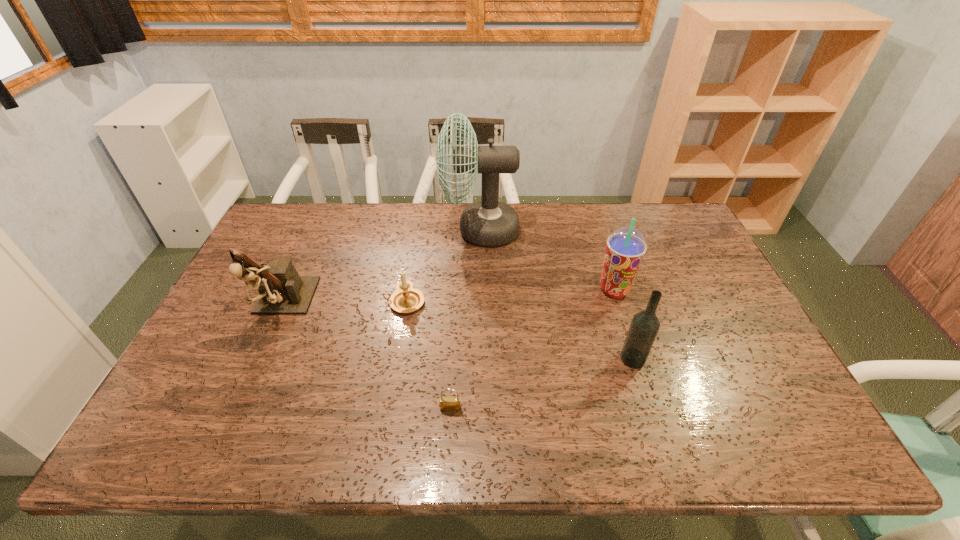
At what (x,y) coordinates should I click in order to perform the action: click on fan. Please return your answer as a coordinate pair (x, y). Looking at the image, I should click on (489, 222).

This screenshot has height=540, width=960. I want to click on the tallest object, so click(489, 222).

Find the location of `the leftmost object`. the leftmost object is located at coordinates (281, 290).

Identify the location of smoothie. This screenshot has width=960, height=540. (625, 248).

In order to click on the second nearest object in this screenshot , I will do `click(645, 325)`.

In order to click on the fifth object from right to left in this screenshot , I will do `click(406, 299)`.

The height and width of the screenshot is (540, 960). Identify the location of candle holder. (406, 299).

Where is `the nearest object`? This screenshot has height=540, width=960. the nearest object is located at coordinates (447, 403).

I want to click on the shortest object, so click(447, 403).

Where is `free space located in front of the fan where the airflow is directed`? This screenshot has width=960, height=540. free space located in front of the fan where the airflow is directed is located at coordinates (337, 230).